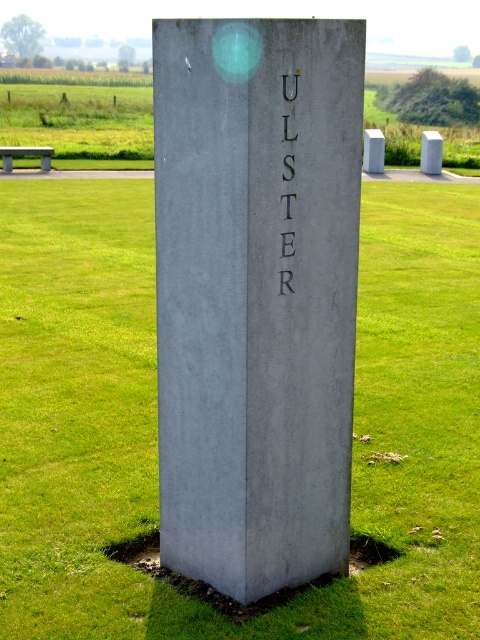
You are standing in a field and see the gray concrete monument at center. If you want to reach the monument quickly, how many steps would you estimate you need to take, assuming each step covers about 2.5 feet?

The gray concrete monument at center is 10.43 feet away. Since each step covers 2.5 feet, you would need approximately 4 steps to reach it.

You are standing in front of the monument and want to place a small flag exactly at the center of the green grass at center. According to the coordinates provided, where should you place the flag?

The flag should be placed at the coordinates point [156,420] since that is the 2D location of the green grass at center.

You are a landscape architect designing a new park. You want to place a small decorative stone statue that is 1.2 meters tall next to the gray concrete monument at center. Based on the image, will the statue be shorter than the black metal text at center?

The gray concrete monument at center is taller than the black metal text at center. Since the statue is 1.2 meters tall, we need to compare it to the height of the black metal text at center. However, the description only states the monument is taller than the text, but does not provide specific measurements for either. Therefore, it is impossible to determine if the statue will be shorter than the black metal text at center without additional information about their exact heights.